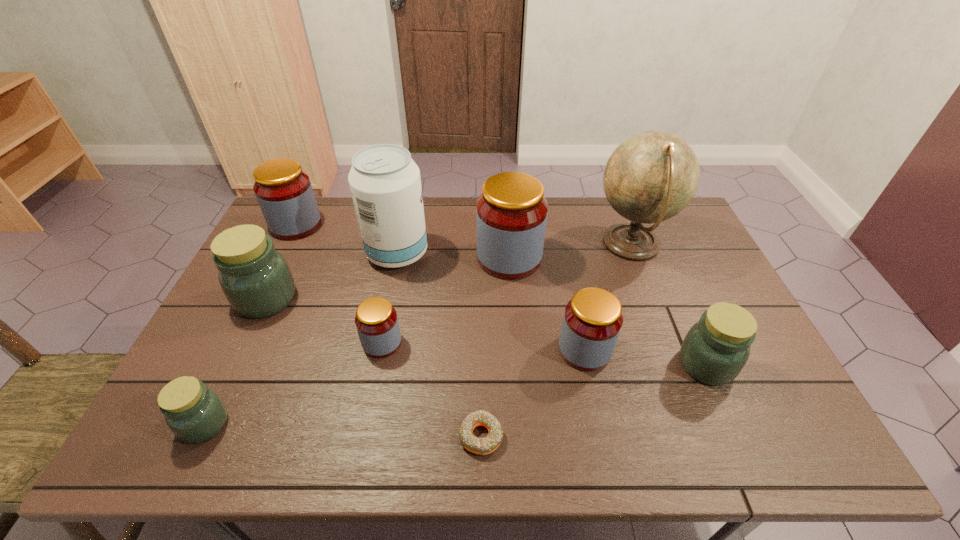
At what (x,y) coordinates should I click in order to perform the action: click on free spot at the right edge of the desktop. Please return your answer as a coordinate pair (x, y). The height and width of the screenshot is (540, 960). Looking at the image, I should click on (732, 404).

This screenshot has height=540, width=960. What are the coordinates of `free space between the smallest red jar and the eighth object from left to right` in the screenshot? It's located at pyautogui.click(x=484, y=346).

Locate an element on the screen. The image size is (960, 540). vacant area that lies between the alcohol and the doughnut is located at coordinates (440, 345).

Locate an element on the screen. free spot between the alcohol and the second red jar from right to left is located at coordinates (453, 256).

Locate an element on the screen. free space between the shortest object and the second red jar from right to left is located at coordinates (495, 347).

The height and width of the screenshot is (540, 960). Identify the location of empty location between the alcohol and the second jar from right to left. (492, 302).

This screenshot has width=960, height=540. I want to click on free space between the alcohol and the smallest green jar, so click(301, 339).

The image size is (960, 540). Identify the location of empty location between the chocolate doughnut and the biggest red jar. (495, 347).

This screenshot has width=960, height=540. Find the location of `free area in between the smallest green jar and the tallest jar`. free area in between the smallest green jar and the tallest jar is located at coordinates (357, 341).

At what (x,y) coordinates should I click in order to perform the action: click on vacant area that lies between the farthest green jar and the third red jar from left to right. Please return your answer as a coordinate pair (x, y). Looking at the image, I should click on (388, 279).